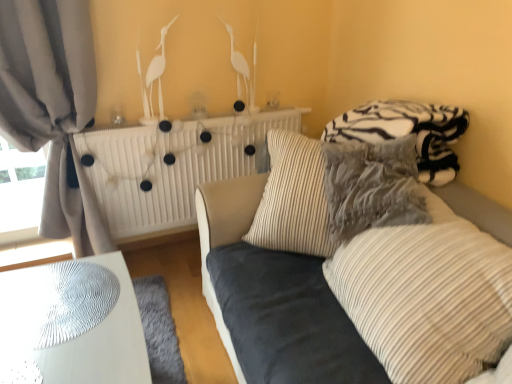
Identify the location of white matte radiator at upper center. The height and width of the screenshot is (384, 512). (170, 166).

Find the location of a particular element. Image resolution: width=512 pixels, height=384 pixels. striped fabric pillow at center, which ranks as the 2th pillow in back-to-front order is located at coordinates (431, 289).

Measure the distance between striped fabric pillow at center, acting as the 1th pillow starting from the front, and camera.

The distance of striped fabric pillow at center, acting as the 1th pillow starting from the front, from camera is 1.12 meters.

Image resolution: width=512 pixels, height=384 pixels. Identify the location of striped fabric pillow at center, which is counted as the 1th pillow, starting from the back. (293, 198).

Identify the location of white glossy table at lower left. coord(76,321).

Image resolution: width=512 pixels, height=384 pixels. I want to click on white matte radiator at upper center, so click(x=170, y=166).

Does point (449, 168) appear closer or farther from the camera than point (289, 150)?

Point (449, 168) is positioned closer to the camera compared to point (289, 150).

Is zebra-patterned fleece blanket at upper right facing away from striped fabric pillow at center, which is counted as the 1th pillow, starting from the back?

That's not correct — zebra-patterned fleece blanket at upper right is not looking away from striped fabric pillow at center, which is counted as the 1th pillow, starting from the back.

Locate an element on the screen. The height and width of the screenshot is (384, 512). the 2nd pillow to the left of the zebra-patterned fleece blanket at upper right, counting from the anchor's position is located at coordinates (293, 198).

Does zebra-patterned fleece blanket at upper right appear on the left side of striped fabric pillow at center, arranged as the second pillow when viewed from the front?

No.

Does velvet blue couch at center have a greater width compared to striped fabric pillow at center, which is counted as the 1th pillow, starting from the back?

Yes, velvet blue couch at center is wider than striped fabric pillow at center, which is counted as the 1th pillow, starting from the back.

Is velvet blue couch at center looking in the opposite direction of striped fabric pillow at center, which is counted as the 1th pillow, starting from the back?

Absolutely, velvet blue couch at center is directed away from striped fabric pillow at center, which is counted as the 1th pillow, starting from the back.

From the image's perspective, would you say velvet blue couch at center is positioned over striped fabric pillow at center, arranged as the second pillow when viewed from the front?

No, from the image's perspective, velvet blue couch at center is not on top of striped fabric pillow at center, arranged as the second pillow when viewed from the front.

Does velvet blue couch at center have a larger size compared to striped fabric pillow at center, arranged as the second pillow when viewed from the front?

Yes, velvet blue couch at center is bigger than striped fabric pillow at center, arranged as the second pillow when viewed from the front.

Consider the image. Which of these two, velvet blue couch at center or striped fabric pillow at center, acting as the 1th pillow starting from the front, is thinner?

striped fabric pillow at center, acting as the 1th pillow starting from the front, is thinner.

Measure the distance from velvet blue couch at center to striped fabric pillow at center, acting as the 1th pillow starting from the front.

velvet blue couch at center and striped fabric pillow at center, acting as the 1th pillow starting from the front, are 4.50 inches apart.

From a real-world perspective, which is physically below, velvet blue couch at center or striped fabric pillow at center, acting as the 1th pillow starting from the front?

From a 3D spatial view, velvet blue couch at center is below.

Which of these two, velvet blue couch at center or striped fabric pillow at center, acting as the 1th pillow starting from the front, stands shorter?

With less height is velvet blue couch at center.

Consider the image. From the image's perspective, which is below, gray fabric curtain at left or white glossy table at lower left?

white glossy table at lower left appears lower in the image.

Between gray fabric curtain at left and white glossy table at lower left, which one is positioned behind?

gray fabric curtain at left.

Can you confirm if gray fabric curtain at left is positioned to the left of white glossy table at lower left?

Indeed, gray fabric curtain at left is positioned on the left side of white glossy table at lower left.

Could you tell me if gray fabric curtain at left is turned towards white glossy table at lower left?

Yes, gray fabric curtain at left is oriented towards white glossy table at lower left.

Considering the positions of objects striped fabric pillow at center, which is counted as the 1th pillow, starting from the back, and velvet blue couch at center in the image provided, who is behind, striped fabric pillow at center, which is counted as the 1th pillow, starting from the back, or velvet blue couch at center?

Result: striped fabric pillow at center, which is counted as the 1th pillow, starting from the back.

Visually, is striped fabric pillow at center, arranged as the second pillow when viewed from the front, positioned to the left or to the right of velvet blue couch at center?

From the image, it's evident that striped fabric pillow at center, arranged as the second pillow when viewed from the front, is to the left of velvet blue couch at center.

What's the angular difference between striped fabric pillow at center, which is counted as the 1th pillow, starting from the back, and velvet blue couch at center's facing directions?

51.7 degrees.

From the image's perspective, is striped fabric pillow at center, arranged as the second pillow when viewed from the front, positioned above or below velvet blue couch at center?

Clearly, from the image's perspective, striped fabric pillow at center, arranged as the second pillow when viewed from the front, is above velvet blue couch at center.

Relative to velvet blue couch at center, is white glossy table at lower left in front or behind?

white glossy table at lower left is behind velvet blue couch at center.

Is white glossy table at lower left with velvet blue couch at center?

They are not placed beside each other.

Considering the sizes of white glossy table at lower left and velvet blue couch at center in the image, is white glossy table at lower left wider or thinner than velvet blue couch at center?

Clearly, white glossy table at lower left has less width compared to velvet blue couch at center.

Is velvet blue couch at center completely or partially inside white glossy table at lower left?

No, velvet blue couch at center is not surrounded by white glossy table at lower left.

Where is `radiator lying behind the gray fabric curtain at left`? Image resolution: width=512 pixels, height=384 pixels. radiator lying behind the gray fabric curtain at left is located at coordinates pyautogui.click(x=170, y=166).

From a real-world perspective, is white matte radiator at upper center under gray fabric curtain at left?

Correct, in the physical world, white matte radiator at upper center is lower than gray fabric curtain at left.

Between point (250, 156) and point (74, 35), which one is positioned in front?

Point (74, 35)

Is white matte radiator at upper center further to the viewer compared to gray fabric curtain at left?

Yes.

This screenshot has width=512, height=384. Identify the location of bedding behind the striped fabric pillow at center, which is counted as the 1th pillow, starting from the back. (407, 132).

Locate an element on the screen. The height and width of the screenshot is (384, 512). studio couch lying in front of the striped fabric pillow at center, which is counted as the 1th pillow, starting from the back is located at coordinates (352, 289).

Which object lies further to the anchor point striped fabric pillow at center, which is counted as the 1th pillow, starting from the back, striped fabric pillow at center, which ranks as the 2th pillow in back-to-front order, or white matte radiator at upper center?

white matte radiator at upper center is further to striped fabric pillow at center, which is counted as the 1th pillow, starting from the back.

Estimate the real-world distances between objects in this image. Which object is further from velvet blue couch at center, white glossy table at lower left or zebra-patterned fleece blanket at upper right?

white glossy table at lower left.

Estimate the real-world distances between objects in this image. Which object is further from gray fabric curtain at left, velvet blue couch at center or white matte radiator at upper center?

velvet blue couch at center lies further to gray fabric curtain at left than the other object.

Considering their positions, is gray fabric curtain at left positioned further to velvet blue couch at center than striped fabric pillow at center, acting as the 1th pillow starting from the front?

gray fabric curtain at left lies further to velvet blue couch at center than the other object.

In the scene shown: When comparing their distances from white matte radiator at upper center, does striped fabric pillow at center, arranged as the second pillow when viewed from the front, or striped fabric pillow at center, acting as the 1th pillow starting from the front, seem further?

striped fabric pillow at center, acting as the 1th pillow starting from the front, is further to white matte radiator at upper center.

Looking at the image, which one is located further to striped fabric pillow at center, which is counted as the 1th pillow, starting from the back, gray fabric curtain at left or white matte radiator at upper center?

gray fabric curtain at left is further to striped fabric pillow at center, which is counted as the 1th pillow, starting from the back.

Considering their positions, is white glossy table at lower left positioned further to velvet blue couch at center than gray fabric curtain at left?

gray fabric curtain at left lies further to velvet blue couch at center than the other object.

When comparing their distances from striped fabric pillow at center, which ranks as the 2th pillow in back-to-front order, does gray fabric curtain at left or zebra-patterned fleece blanket at upper right seem closer?

Result: zebra-patterned fleece blanket at upper right.

Where is `table positioned between velvet blue couch at center and white matte radiator at upper center from near to far`? This screenshot has width=512, height=384. table positioned between velvet blue couch at center and white matte radiator at upper center from near to far is located at coordinates (76, 321).

Image resolution: width=512 pixels, height=384 pixels. In order to click on pillow located between gray fabric curtain at left and velvet blue couch at center in the left-right direction in this screenshot , I will do `click(293, 198)`.

The image size is (512, 384). In order to click on studio couch between striped fabric pillow at center, acting as the 1th pillow starting from the front, and white matte radiator at upper center in the front-back direction in this screenshot , I will do `click(352, 289)`.

The height and width of the screenshot is (384, 512). I want to click on table between gray fabric curtain at left and zebra-patterned fleece blanket at upper right, so click(x=76, y=321).